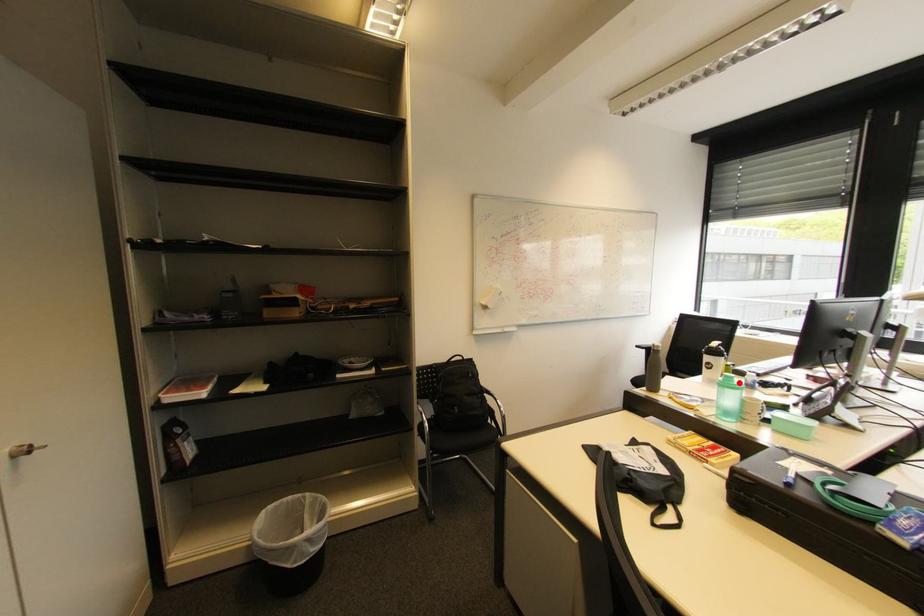
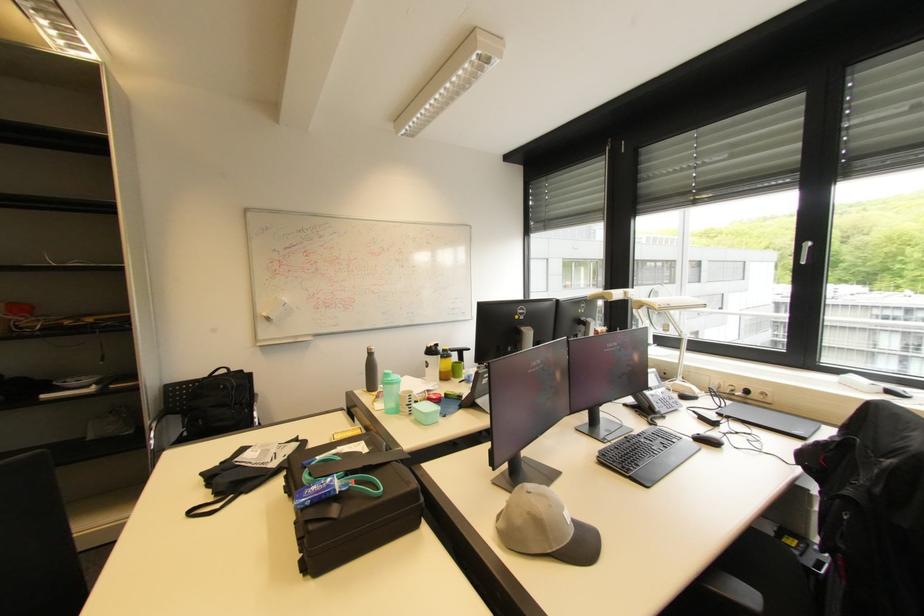
Where in the second image is the point corresponding to the highlighted location from the first image?

(394, 379)